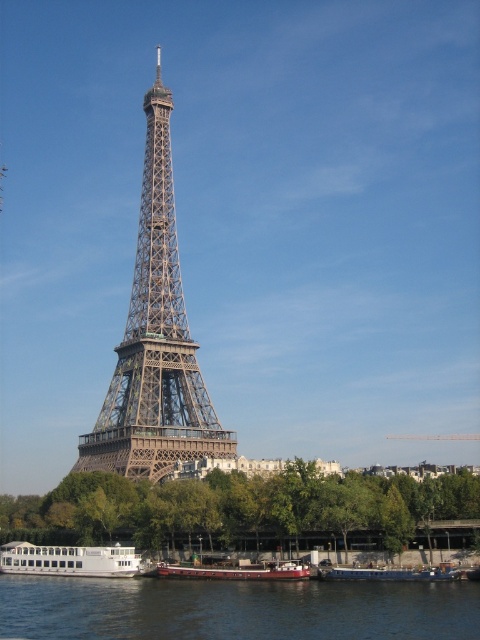
Question: Observing the image, what is the correct spatial positioning of red matte barge at lower center in reference to white plastic boat at lower center?

Choices:
 (A) right
 (B) left

Answer: (B)

Question: Is dark blue water at lower center further to camera compared to metallic structure at center?

Choices:
 (A) yes
 (B) no

Answer: (B)

Question: Is green leafy tree at lower center below dark blue water at lower center?

Choices:
 (A) no
 (B) yes

Answer: (A)

Question: Which object appears farthest from the camera in this image?

Choices:
 (A) white matte boat at lower left
 (B) metallic structure at center

Answer: (A)

Question: Which object is the closest to the white plastic boat at lower center?

Choices:
 (A) white matte boat at lower left
 (B) green leafy tree at lower center
 (C) dark blue water at lower center
 (D) red matte barge at lower center

Answer: (D)

Question: Which of the following is the farthest from the observer?

Choices:
 (A) (117, 564)
 (B) (139, 234)
 (C) (252, 508)

Answer: (B)